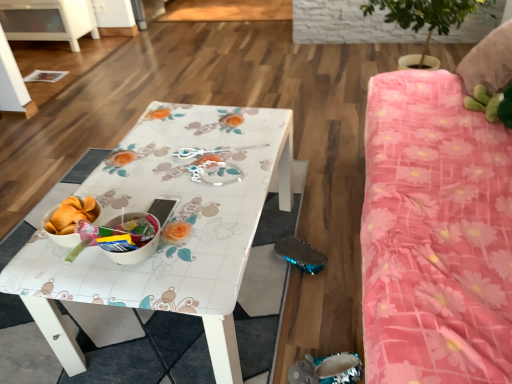
Question: Is clear plastic spoon at center inside or outside of white glossy table at center?

Choices:
 (A) inside
 (B) outside

Answer: (A)

Question: Is clear plastic spoon at center taller or shorter than white glossy table at center?

Choices:
 (A) tall
 (B) short

Answer: (B)

Question: Which is nearer to the pink floral fabric bed at right?

Choices:
 (A) white glossy table at center
 (B) clear plastic spoon at center

Answer: (A)

Question: Which of these objects is positioned farthest from the white glossy table at center?

Choices:
 (A) clear plastic spoon at center
 (B) pink floral fabric bed at right

Answer: (B)